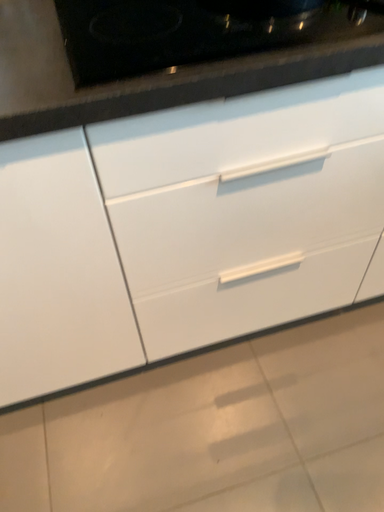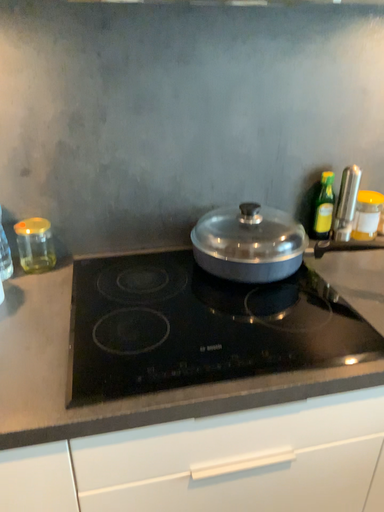
Question: Which way did the camera rotate in the video?

Choices:
 (A) rotated downward
 (B) rotated upward

Answer: (B)